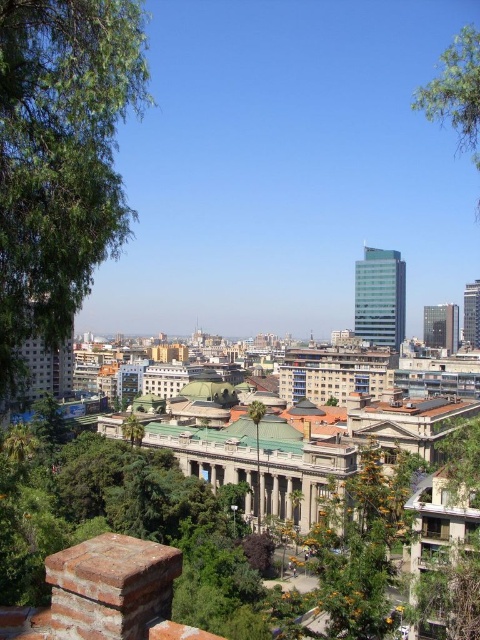
Question: Which is farther from the green leafy tree at upper right?

Choices:
 (A) green leafy tree at center
 (B) green leafy tree at left

Answer: (A)

Question: Which of these objects is positioned farthest from the green leafy tree at center?

Choices:
 (A) green leafy tree at left
 (B) green leafy tree at upper right

Answer: (B)

Question: Is green leafy tree at left smaller than green leafy tree at upper right?

Choices:
 (A) yes
 (B) no

Answer: (A)

Question: Does green leafy tree at left have a smaller size compared to green leafy tree at center?

Choices:
 (A) no
 (B) yes

Answer: (A)

Question: Which of these objects is positioned farthest from the green leafy tree at left?

Choices:
 (A) green leafy tree at center
 (B) green leafy tree at upper right

Answer: (A)

Question: Can you confirm if green leafy tree at upper right is smaller than green leafy tree at center?

Choices:
 (A) yes
 (B) no

Answer: (B)